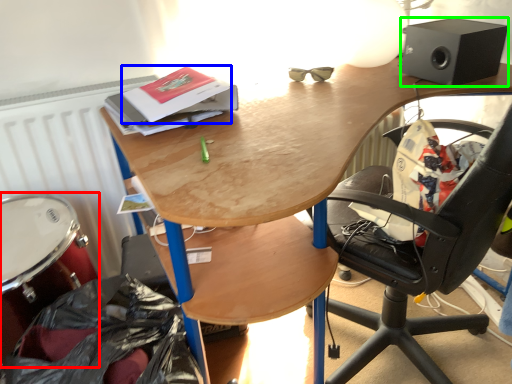
Question: Estimate the real-world distances between objects in this image. Which object is closer to drum (highlighted by a red box), paperback book (highlighted by a blue box) or loudspeaker (highlighted by a green box)?

Choices:
 (A) paperback book
 (B) loudspeaker

Answer: (A)